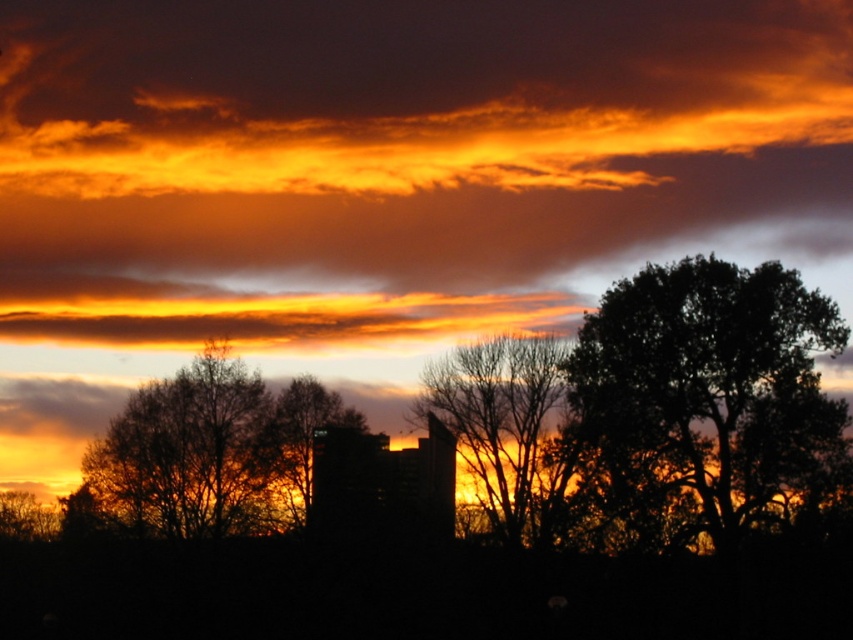
Question: Can you confirm if dark green leafy tree at right is positioned to the right of silhouette leafy tree at center?

Choices:
 (A) yes
 (B) no

Answer: (A)

Question: Which object is positioned farthest from the bare branches at center?

Choices:
 (A) silhouette leafy tree at center
 (B) dark green leafy tree at right
 (C) brown textured tree at center

Answer: (C)

Question: Which of the following is the closest to the observer?

Choices:
 (A) bare branches at center
 (B) dark green leafy tree at right
 (C) silhouette leafy tree at center

Answer: (B)

Question: Is brown textured tree at center below bare branches at center?

Choices:
 (A) no
 (B) yes

Answer: (B)

Question: Does bare branches at center appear on the right side of silhouette leafy tree at center?

Choices:
 (A) yes
 (B) no

Answer: (A)

Question: Which object is positioned farthest from the brown textured tree at center?

Choices:
 (A) dark green leafy tree at right
 (B) bare branches at center
 (C) silhouette leafy tree at center

Answer: (A)